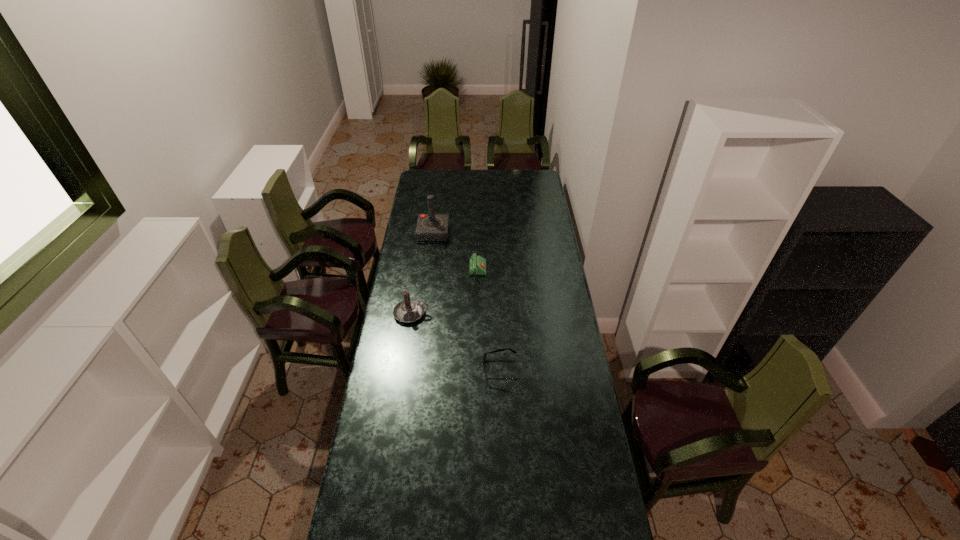
Identify the location of free space that is in between the sunglasses and the farthest object. This screenshot has width=960, height=540. click(x=467, y=301).

In order to click on vacant point located between the telephone and the candle in this screenshot , I will do tap(444, 295).

Find the location of a particular element. The width and height of the screenshot is (960, 540). empty space that is in between the shortest object and the third shortest object is located at coordinates (456, 342).

Locate an element on the screen. unoccupied area between the sunglasses and the third nearest object is located at coordinates (489, 323).

Locate an element on the screen. The height and width of the screenshot is (540, 960). vacant space that is in between the telephone and the candle is located at coordinates (444, 295).

Image resolution: width=960 pixels, height=540 pixels. I want to click on vacant area that lies between the joystick and the shortest object, so point(467,301).

This screenshot has height=540, width=960. What are the coordinates of `vacant region between the shortest object and the second nearest object` in the screenshot? It's located at (456, 342).

I want to click on empty location between the sunglasses and the third farthest object, so click(456, 342).

Image resolution: width=960 pixels, height=540 pixels. I want to click on free point between the second tallest object and the nearest object, so click(x=456, y=342).

Where is `vacant point located between the candle and the joystick`? This screenshot has width=960, height=540. vacant point located between the candle and the joystick is located at coordinates (422, 273).